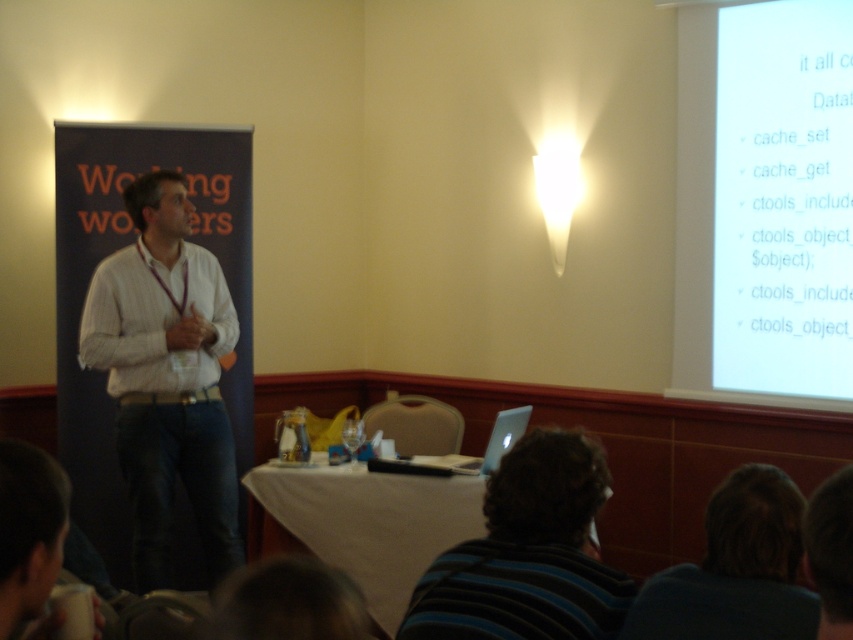
You are an attendee at the presentation and want to locate the speaker. Which object is closer to the front of the room? The white striped shirt at center or the dark brown hair at upper center?

The white striped shirt at center is closer to the front of the room because it is positioned to the left of the dark brown hair at upper center, which is further back.

You are an attendee at the presentation. You notice the white glossy projector screen at upper right and the white striped shirt at center. Which object is bigger in size?

The white glossy projector screen at upper right is larger in size than the white striped shirt at center.